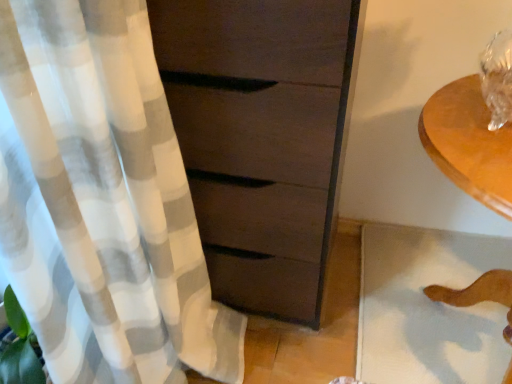
In order to face light brown wooden table at upper right, should I rotate leftwards or rightwards?

To align with it, rotate right about 29.333°.

You are a GUI agent. You are given a task and a screenshot of the screen. Output one action in this format:
    pyautogui.click(x=<x>, y=<y>)
    Task: Click on the light brown wooden table at upper right
    
    Given the screenshot: What is the action you would take?
    pyautogui.click(x=469, y=143)

Describe the element at coordinates (469, 143) in the screenshot. The height and width of the screenshot is (384, 512). I see `light brown wooden table at upper right` at that location.

I want to click on light brown wooden table at upper right, so click(469, 143).